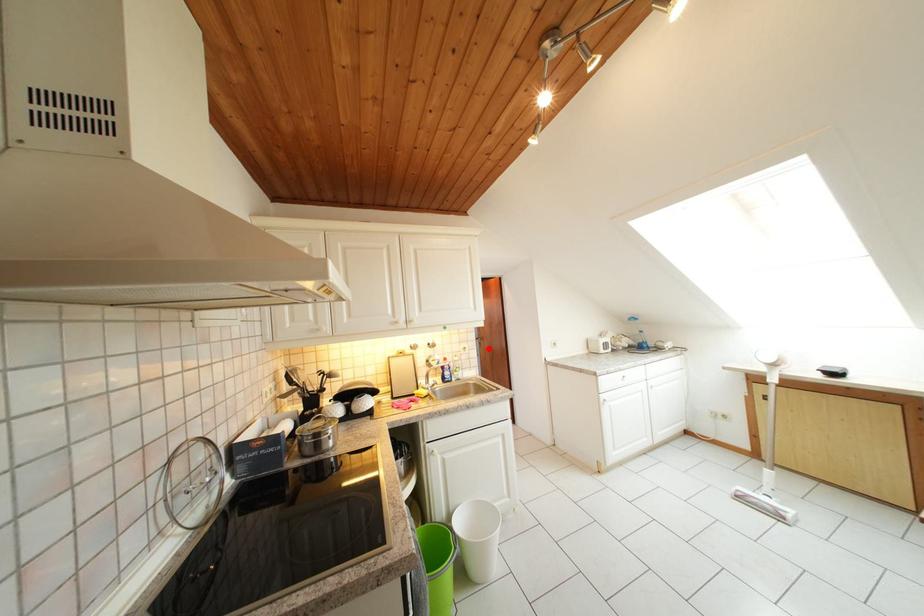
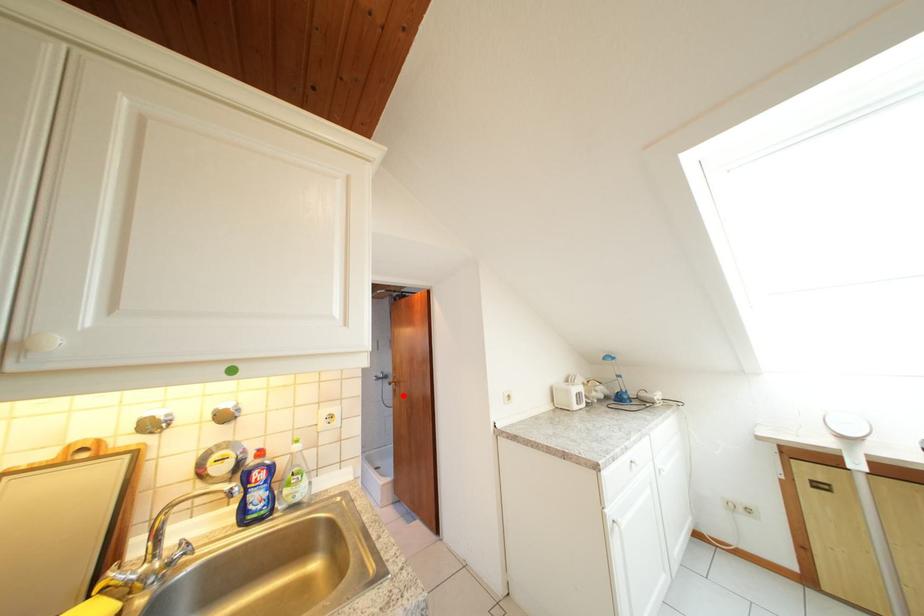
I am providing you with two images of the same scene from different viewpoints. A red point is marked on the first image and another point is marked on the second image. Are the points marked in image1 and image2 representing the same 3D position?

Yes